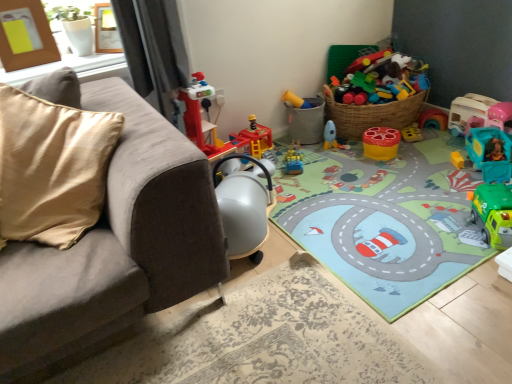
Image resolution: width=512 pixels, height=384 pixels. In order to click on vacant space in between teal plastic toy car at right, placed as the second toy when sorted from right to left, and yellow matte stool at center, placed as the fourth toy when sorted from right to left in this screenshot , I will do `click(424, 156)`.